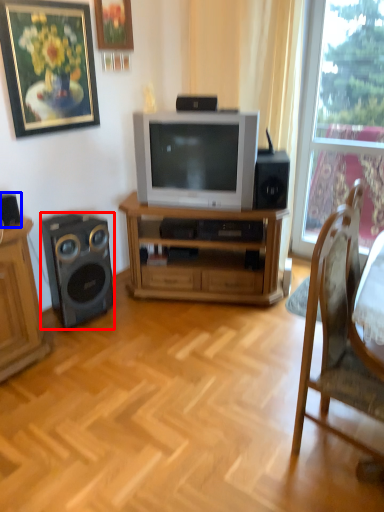
Question: Which of the following is the closest to the observer, loudspeaker (highlighted by a red box) or speaker (highlighted by a blue box)?

Choices:
 (A) loudspeaker
 (B) speaker

Answer: (B)